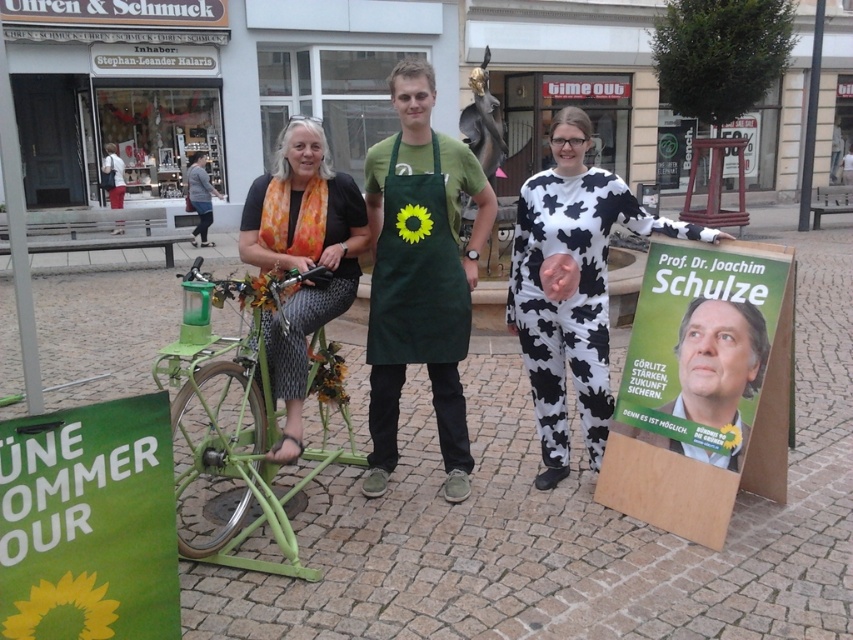
You are a photographer standing at the center of the scene. You want to adjust the camera focus so that both the green fabric apron with sunflower at center and the gray cotton shirt at upper left are in sharp focus. Given that your camera can only focus on objects within a 5 meter range, will both be in focus?

The green fabric apron with sunflower at center and the gray cotton shirt at upper left are 10.94 meters apart from each other. Since the camera can only focus within a 5 meter range, the distance between them exceeds this limit. Therefore, both cannot be in focus simultaneously.

You are a photographer setting up for a group photo. You need to ensure that the green matte bicycle at center and the gray cotton shirt at upper left are both visible in the frame. Based on their sizes, which object might require more space horizontally to fit comfortably in the photo?

The green matte bicycle at center might require more space horizontally than the gray cotton shirt at upper left because it is wider according to the description.